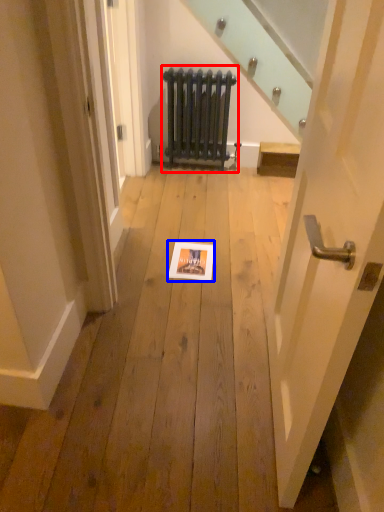
Question: Among these objects, which one is nearest to the camera, radiator (highlighted by a red box) or picture frame (highlighted by a blue box)?

Choices:
 (A) radiator
 (B) picture frame

Answer: (B)